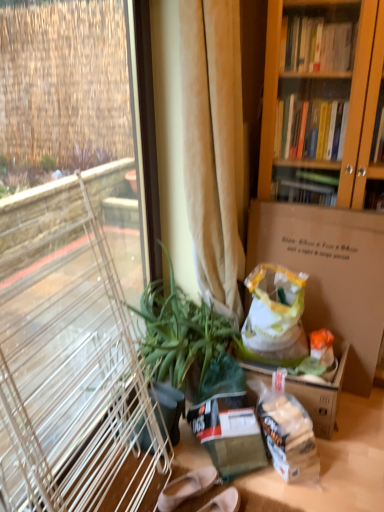
Question: Is brown cardboard box at center-right shorter than beige fabric curtain at center?

Choices:
 (A) no
 (B) yes

Answer: (B)

Question: Is brown cardboard box at center-right not close to beige fabric curtain at center?

Choices:
 (A) no
 (B) yes

Answer: (A)

Question: Is brown cardboard box at center-right aimed at beige fabric curtain at center?

Choices:
 (A) yes
 (B) no

Answer: (B)

Question: From a real-world perspective, does brown cardboard box at center-right sit lower than beige fabric curtain at center?

Choices:
 (A) yes
 (B) no

Answer: (A)

Question: Is brown cardboard box at center-right positioned with its back to beige fabric curtain at center?

Choices:
 (A) no
 (B) yes

Answer: (A)

Question: Considering the positions of matte beige shoes at lower center and brown cardboard box at center-right in the image, is matte beige shoes at lower center wider or thinner than brown cardboard box at center-right?

Choices:
 (A) wide
 (B) thin

Answer: (B)

Question: Is matte beige shoes at lower center situated inside brown cardboard box at center-right or outside?

Choices:
 (A) inside
 (B) outside

Answer: (B)

Question: Is matte beige shoes at lower center to the left or to the right of brown cardboard box at center-right in the image?

Choices:
 (A) left
 (B) right

Answer: (A)

Question: In terms of size, does matte beige shoes at lower center appear bigger or smaller than brown cardboard box at center-right?

Choices:
 (A) small
 (B) big

Answer: (A)

Question: Is point coord(200,468) closer or farther from the camera than point coord(183,153)?

Choices:
 (A) closer
 (B) farther

Answer: (B)

Question: Visually, is matte beige shoes at lower center positioned to the left or to the right of beige fabric curtain at center?

Choices:
 (A) right
 (B) left

Answer: (B)

Question: From a real-world perspective, is matte beige shoes at lower center positioned above or below beige fabric curtain at center?

Choices:
 (A) above
 (B) below

Answer: (B)

Question: From the image's perspective, relative to beige fabric curtain at center, is matte beige shoes at lower center above or below?

Choices:
 (A) above
 (B) below

Answer: (B)

Question: From the image's perspective, is beige fabric curtain at center above or below brown cardboard box at center-right?

Choices:
 (A) above
 (B) below

Answer: (A)

Question: Is point (238, 211) closer or farther from the camera than point (264, 212)?

Choices:
 (A) farther
 (B) closer

Answer: (A)